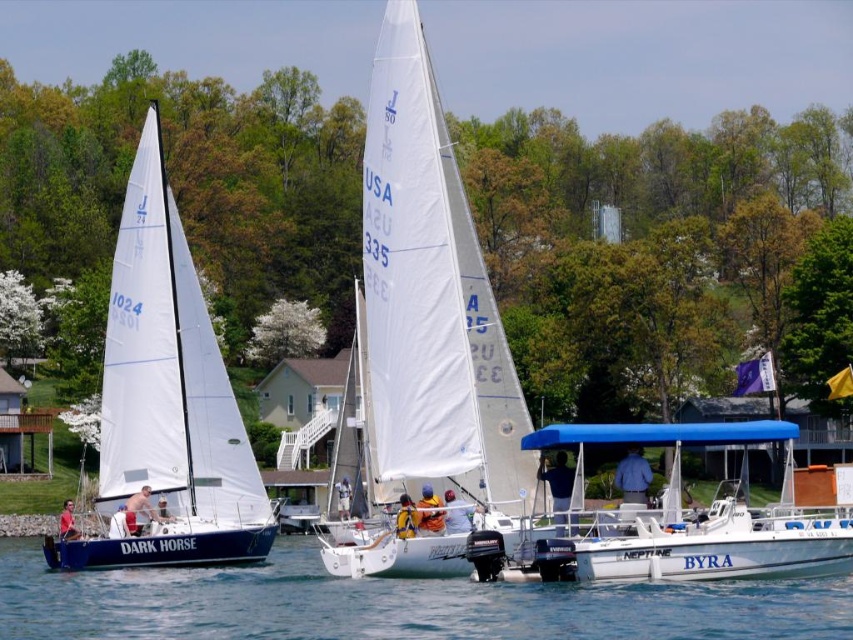
Between transparent blue water at center and white matte motorboat at lower right, which one appears on the right side from the viewer's perspective?

From the viewer's perspective, white matte motorboat at lower right appears more on the right side.

Where is `transparent blue water at center`? The height and width of the screenshot is (640, 853). transparent blue water at center is located at coordinates (393, 604).

In the scene shown: Does white sailboat at center have a lesser width compared to white sailboat at left?

Yes.

Looking at this image, which of these two, white sailboat at center or white sailboat at left, stands taller?

white sailboat at center

Locate an element on the screen. This screenshot has width=853, height=640. white sailboat at center is located at coordinates (431, 308).

You are a GUI agent. You are given a task and a screenshot of the screen. Output one action in this format:
    pyautogui.click(x=<x>, y=<y>)
    Task: Click on the white sailboat at center
    The image size is (853, 640).
    Given the screenshot: What is the action you would take?
    pyautogui.click(x=431, y=308)

Can you confirm if white sailboat at left is shorter than white matte motorboat at lower right?

No.

The width and height of the screenshot is (853, 640). What do you see at coordinates (165, 404) in the screenshot?
I see `white sailboat at left` at bounding box center [165, 404].

This screenshot has height=640, width=853. What are the coordinates of `white sailboat at left` in the screenshot? It's located at (165, 404).